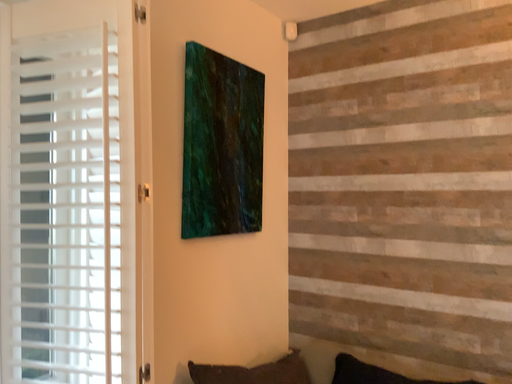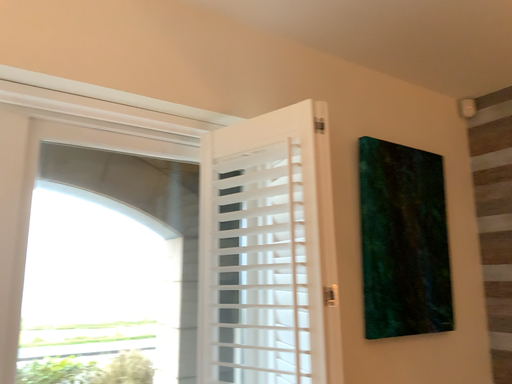
Question: Which way did the camera rotate in the video?

Choices:
 (A) rotated downward
 (B) rotated upward

Answer: (B)